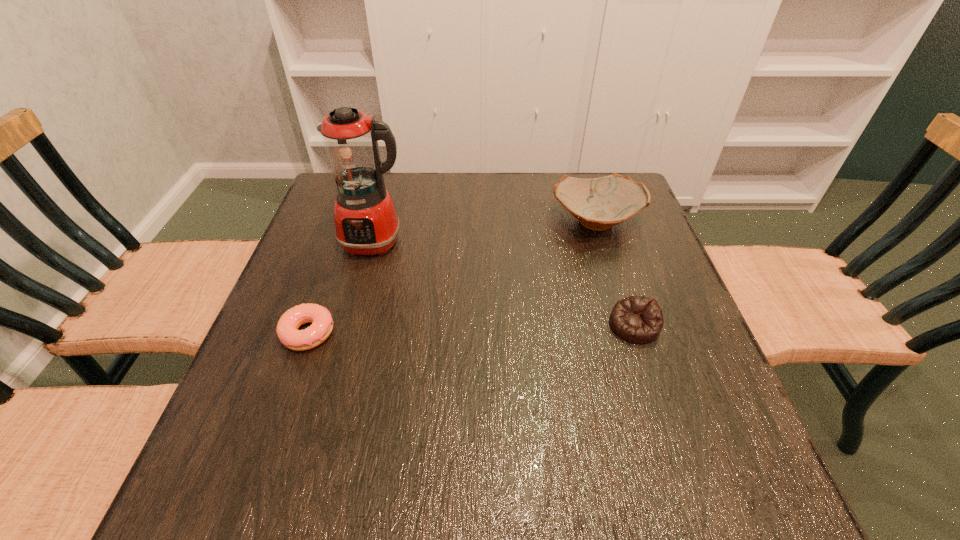
This screenshot has width=960, height=540. Identify the location of the tallest object. (366, 223).

This screenshot has width=960, height=540. Identify the location of pottery. (600, 203).

This screenshot has height=540, width=960. In order to click on beanbag in this screenshot , I will do `click(638, 319)`.

At what (x,y) coordinates should I click in order to perform the action: click on doughnut. Please return your answer as a coordinate pair (x, y). This screenshot has height=540, width=960. Looking at the image, I should click on (287, 331).

Image resolution: width=960 pixels, height=540 pixels. Identify the location of free space located on the controls of the tallest object. (336, 386).

At what (x,y) coordinates should I click in order to perform the action: click on vacant region located 0.240m on the left of the pottery. Please return your answer as a coordinate pair (x, y). Looking at the image, I should click on (460, 221).

You are a GUI agent. You are given a task and a screenshot of the screen. Output one action in this format:
    pyautogui.click(x=<x>, y=<y>)
    Task: Click on the free space located on the back of the beanbag
    The height and width of the screenshot is (540, 960).
    Given the screenshot: What is the action you would take?
    pyautogui.click(x=598, y=214)

At what (x,y) coordinates should I click in order to perform the action: click on vacant region located on the front of the doughnut. Please return your answer as a coordinate pair (x, y). This screenshot has width=960, height=540. Looking at the image, I should click on (246, 509).

This screenshot has width=960, height=540. Find the location of `object present at the far edge`. object present at the far edge is located at coordinates (600, 203).

Identify the location of food processor positioned at the left edge. The image size is (960, 540). (366, 223).